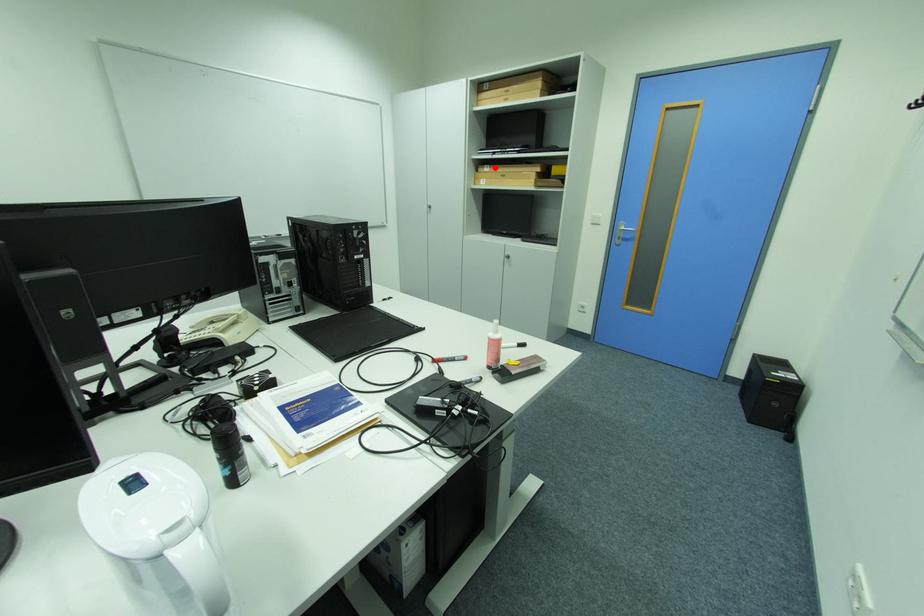
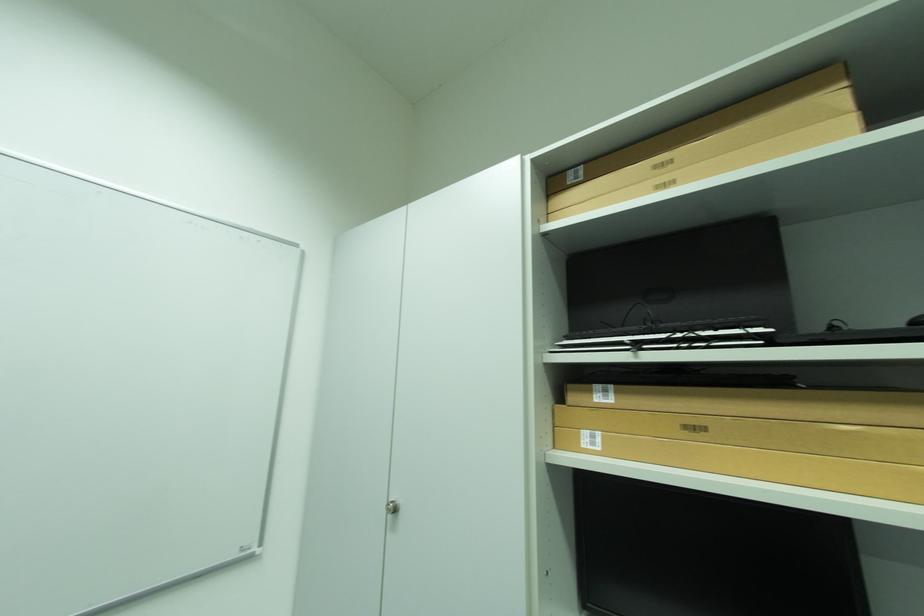
Locate, in the second image, the point that corresponds to the highlighted location in the first image.

(614, 392)